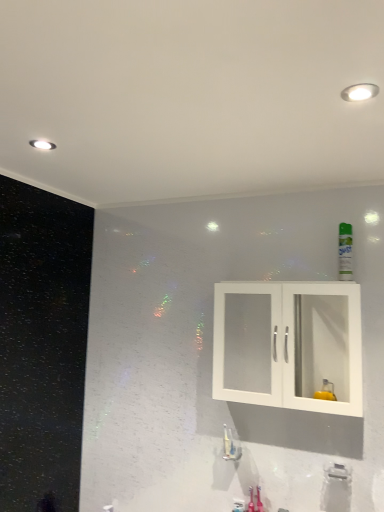
Question: Is white matte cabinet at center smaller than white glossy faucet at lower center, which ranks as the 1th plumbing fixture in back-to-front order?

Choices:
 (A) yes
 (B) no

Answer: (B)

Question: Considering the relative sizes of white matte cabinet at center and white glossy faucet at lower center, placed as the second plumbing fixture when sorted from front to back, in the image provided, is white matte cabinet at center thinner than white glossy faucet at lower center, placed as the second plumbing fixture when sorted from front to back,?

Choices:
 (A) yes
 (B) no

Answer: (B)

Question: Is white matte cabinet at center to the left of white glossy faucet at lower center, the 1th plumbing fixture from the left, from the viewer's perspective?

Choices:
 (A) yes
 (B) no

Answer: (B)

Question: From the image's perspective, is white matte cabinet at center located beneath white glossy faucet at lower center, the 1th plumbing fixture from the left?

Choices:
 (A) yes
 (B) no

Answer: (B)

Question: Considering the relative sizes of white matte cabinet at center and white glossy faucet at lower center, the 1th plumbing fixture viewed from the top, in the image provided, is white matte cabinet at center bigger than white glossy faucet at lower center, the 1th plumbing fixture viewed from the top,?

Choices:
 (A) no
 (B) yes

Answer: (B)

Question: Is point (246, 305) closer or farther from the camera than point (347, 238)?

Choices:
 (A) closer
 (B) farther

Answer: (B)

Question: Is white matte cabinet at center in front of or behind green matte mouthwash at upper right in the image?

Choices:
 (A) behind
 (B) front

Answer: (B)

Question: Considering the positions of white matte cabinet at center and green matte mouthwash at upper right in the image, is white matte cabinet at center taller or shorter than green matte mouthwash at upper right?

Choices:
 (A) tall
 (B) short

Answer: (A)

Question: From a real-world perspective, relative to green matte mouthwash at upper right, is white matte cabinet at center vertically above or below?

Choices:
 (A) below
 (B) above

Answer: (A)

Question: In terms of width, does white matte cabinet at center look wider or thinner when compared to white glossy faucet at lower center, marked as the 2th plumbing fixture in a right-to-left arrangement?

Choices:
 (A) wide
 (B) thin

Answer: (A)

Question: Considering their positions, is white matte cabinet at center located in front of or behind white glossy faucet at lower center, the second plumbing fixture ordered from the bottom?

Choices:
 (A) front
 (B) behind

Answer: (A)

Question: Considering the positions of white matte cabinet at center and white glossy faucet at lower center, placed as the second plumbing fixture when sorted from front to back, in the image, is white matte cabinet at center taller or shorter than white glossy faucet at lower center, placed as the second plumbing fixture when sorted from front to back,?

Choices:
 (A) tall
 (B) short

Answer: (A)

Question: Considering the positions of white matte cabinet at center and white glossy faucet at lower center, the 1th plumbing fixture from the left, in the image, is white matte cabinet at center bigger or smaller than white glossy faucet at lower center, the 1th plumbing fixture from the left,?

Choices:
 (A) big
 (B) small

Answer: (A)

Question: In terms of size, does white plastic faucet at lower center, which is counted as the first plumbing fixture, starting from the right, appear bigger or smaller than white glossy faucet at lower center, marked as the 2th plumbing fixture in a right-to-left arrangement?

Choices:
 (A) big
 (B) small

Answer: (B)

Question: From the image's perspective, is white plastic faucet at lower center, acting as the 2th plumbing fixture starting from the top, positioned above or below white glossy faucet at lower center, the second plumbing fixture ordered from the bottom?

Choices:
 (A) above
 (B) below

Answer: (B)